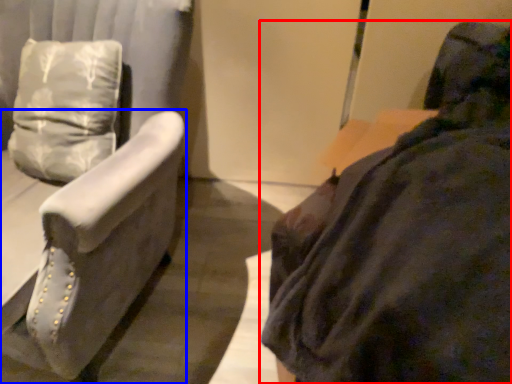
Question: Which object appears farthest to the camera in this image, furniture (highlighted by a red box) or furniture (highlighted by a blue box)?

Choices:
 (A) furniture
 (B) furniture

Answer: (B)